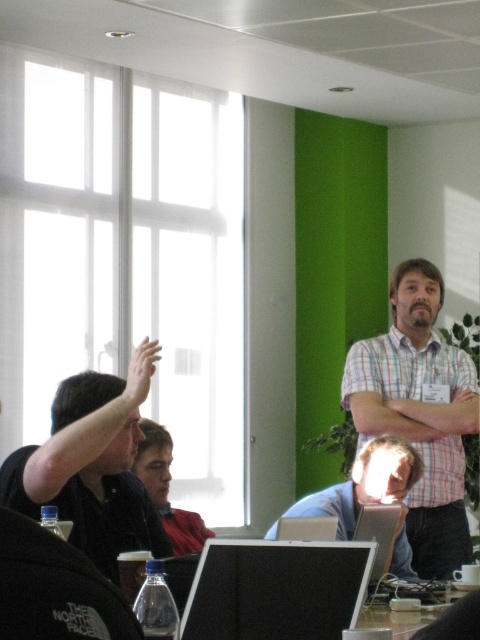
Question: Which point is farther from the camera taking this photo?

Choices:
 (A) (x=244, y=621)
 (B) (x=468, y=394)

Answer: (B)

Question: Which point is closer to the camera?

Choices:
 (A) matte skin hand at upper left
 (B) black plastic table at lower center
 (C) matte black hand at upper right

Answer: (B)

Question: Is matte gray laptop at center thinner than matte skin hand at upper left?

Choices:
 (A) yes
 (B) no

Answer: (B)

Question: Which object is closer to the camera taking this photo?

Choices:
 (A) matte gray laptop at center
 (B) matte black hand at upper right
 (C) plaid fabric shirt at upper right

Answer: (A)

Question: Is black plastic table at lower center smaller than matte skin hand at upper left?

Choices:
 (A) yes
 (B) no

Answer: (A)

Question: Is black glossy monitor at center below plaid fabric shirt at upper right?

Choices:
 (A) yes
 (B) no

Answer: (A)